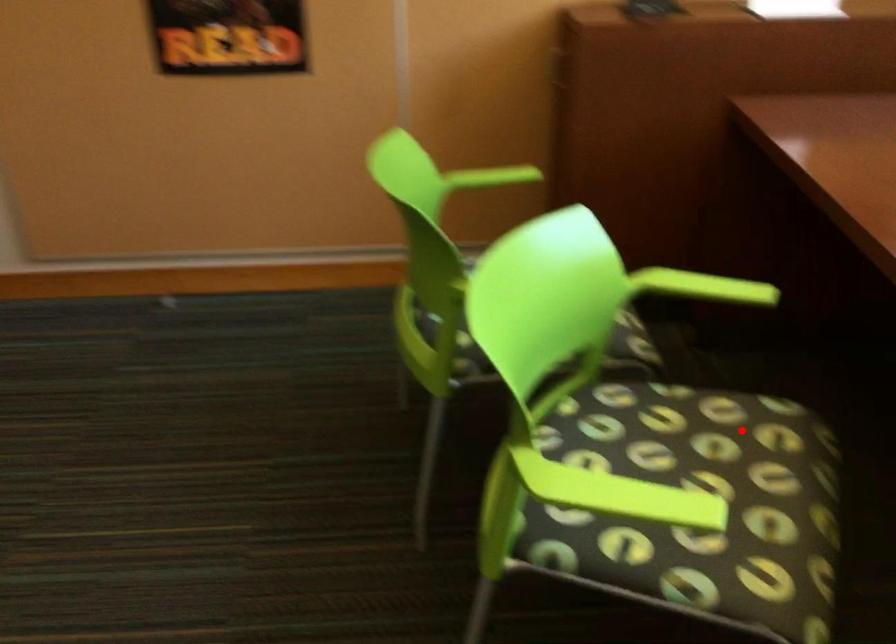
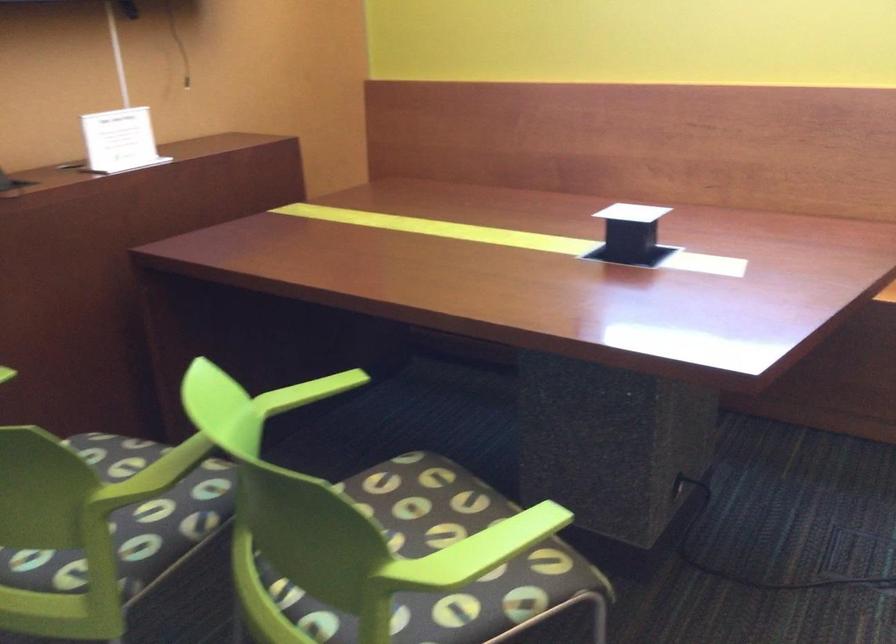
In the second image, find the point that corresponds to the highlighted location in the first image.

(403, 487)